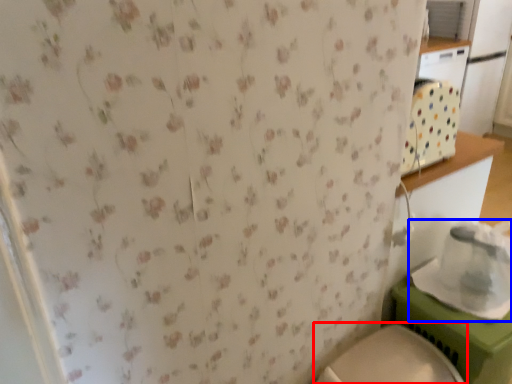
Question: Which point is closer to the camera, toilet (highlighted by a red box) or appliance (highlighted by a blue box)?

Choices:
 (A) toilet
 (B) appliance

Answer: (A)